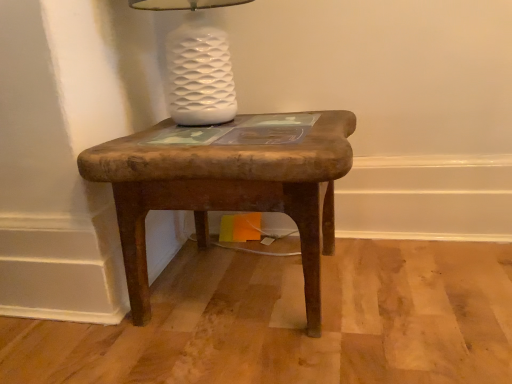
Describe the element at coordinates (197, 64) in the screenshot. I see `white glossy lamp at upper center` at that location.

In the scene shown: Measure the distance between point (181, 87) and camera.

Point (181, 87) is 32.60 inches away from camera.

Locate an element on the screen. The width and height of the screenshot is (512, 384). white glossy lamp at upper center is located at coordinates (197, 64).

Where is `rustic wood stool at center`? This screenshot has width=512, height=384. rustic wood stool at center is located at coordinates (228, 187).

Describe the element at coordinates (228, 187) in the screenshot. Image resolution: width=512 pixels, height=384 pixels. I see `rustic wood stool at center` at that location.

I want to click on white glossy lamp at upper center, so click(x=197, y=64).

Considering the relative positions of white glossy lamp at upper center and rustic wood stool at center in the image provided, is white glossy lamp at upper center to the right of rustic wood stool at center from the viewer's perspective?

Incorrect, white glossy lamp at upper center is not on the right side of rustic wood stool at center.

Which is in front, white glossy lamp at upper center or rustic wood stool at center?

rustic wood stool at center is in front.

Is point (230, 115) behind point (240, 142)?

Yes.

From the image's perspective, is white glossy lamp at upper center below rustic wood stool at center?

No, from the image's perspective, white glossy lamp at upper center is not below rustic wood stool at center.

From a real-world perspective, is white glossy lamp at upper center on top of rustic wood stool at center?

Yes, from a real-world perspective, white glossy lamp at upper center is above rustic wood stool at center.

Between white glossy lamp at upper center and rustic wood stool at center, which one has smaller width?

Thinner between the two is white glossy lamp at upper center.

Who is taller, white glossy lamp at upper center or rustic wood stool at center?

Standing taller between the two is rustic wood stool at center.

Based on the photo, in terms of size, does white glossy lamp at upper center appear bigger or smaller than rustic wood stool at center?

white glossy lamp at upper center is smaller than rustic wood stool at center.

Can rustic wood stool at center be found inside white glossy lamp at upper center?

No, rustic wood stool at center is not a part of white glossy lamp at upper center.

From the picture: Is white glossy lamp at upper center far from rustic wood stool at center?

No.

Is white glossy lamp at upper center oriented towards rustic wood stool at center?

No, white glossy lamp at upper center is not turned towards rustic wood stool at center.

Image resolution: width=512 pixels, height=384 pixels. I want to click on table lamp behind the rustic wood stool at center, so click(197, 64).

Which object is positioned more to the right, rustic wood stool at center or white glossy lamp at upper center?

From the viewer's perspective, rustic wood stool at center appears more on the right side.

Is rustic wood stool at center positioned before white glossy lamp at upper center?

Yes, the depth of rustic wood stool at center is less than that of white glossy lamp at upper center.

Does point (218, 172) appear closer or farther from the camera than point (213, 30)?

Point (218, 172) is closer to the camera than point (213, 30).

From the image's perspective, relative to white glossy lamp at upper center, is rustic wood stool at center above or below?

Based on their image positions, rustic wood stool at center is located beneath white glossy lamp at upper center.

From a real-world perspective, is rustic wood stool at center above or below white glossy lamp at upper center?

rustic wood stool at center is below white glossy lamp at upper center.

Between rustic wood stool at center and white glossy lamp at upper center, which one has smaller width?

white glossy lamp at upper center is thinner.

Considering the sizes of objects rustic wood stool at center and white glossy lamp at upper center in the image provided, who is shorter, rustic wood stool at center or white glossy lamp at upper center?

With less height is white glossy lamp at upper center.

Consider the image. Considering the sizes of objects rustic wood stool at center and white glossy lamp at upper center in the image provided, who is smaller, rustic wood stool at center or white glossy lamp at upper center?

Smaller between the two is white glossy lamp at upper center.

Choose the correct answer: Is rustic wood stool at center inside white glossy lamp at upper center or outside it?

rustic wood stool at center exists outside the volume of white glossy lamp at upper center.

In the scene shown: Is rustic wood stool at center touching white glossy lamp at upper center?

No, rustic wood stool at center is not making contact with white glossy lamp at upper center.

Looking at this image, is rustic wood stool at center oriented towards white glossy lamp at upper center?

No, rustic wood stool at center does not turn towards white glossy lamp at upper center.

Based on the photo, how different are the orientations of rustic wood stool at center and white glossy lamp at upper center in degrees?

0.000414 degrees separate the facing orientations of rustic wood stool at center and white glossy lamp at upper center.

In order to click on table lamp above the rustic wood stool at center (from a real-world perspective) in this screenshot , I will do `click(197, 64)`.

Find the location of a particular element. The image size is (512, 384). stool beneath the white glossy lamp at upper center (from a real-world perspective) is located at coordinates click(x=228, y=187).

This screenshot has width=512, height=384. What are the coordinates of `stool in front of the white glossy lamp at upper center` in the screenshot? It's located at (228, 187).